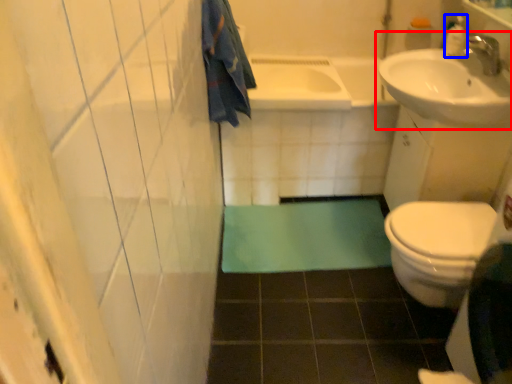
Question: Which object appears farthest to the camera in this image, sink (highlighted by a red box) or toiletry (highlighted by a blue box)?

Choices:
 (A) sink
 (B) toiletry

Answer: (B)